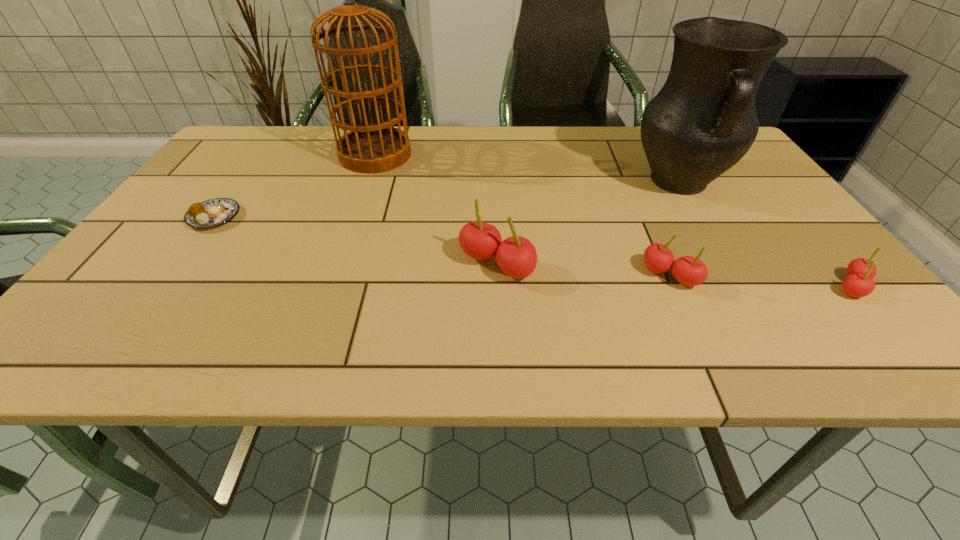
Where is `cherry at the right edge`? The height and width of the screenshot is (540, 960). cherry at the right edge is located at coordinates (859, 283).

Find the location of a particular element. The height and width of the screenshot is (540, 960). pitcher that is positioned at the right edge is located at coordinates (702, 122).

Find the location of a particular element. This screenshot has width=960, height=540. object positioned at the far right corner is located at coordinates (702, 122).

Locate an element on the screen. The image size is (960, 540). object positioned at the near right corner is located at coordinates click(x=859, y=283).

The height and width of the screenshot is (540, 960). What are the coordinates of `vacant space at the far edge` in the screenshot? It's located at (499, 164).

You are a GUI agent. You are given a task and a screenshot of the screen. Output one action in this format:
    pyautogui.click(x=<x>, y=<y>)
    Task: Click on the vacant region at the near edge of the desktop
    This screenshot has height=540, width=960.
    Given the screenshot: What is the action you would take?
    pyautogui.click(x=746, y=287)

Where is `free spot at the left edge of the desktop`? The width and height of the screenshot is (960, 540). free spot at the left edge of the desktop is located at coordinates (228, 178).

This screenshot has height=540, width=960. Identify the location of vacant region at the far left corner of the desktop. (237, 147).

Find the location of `free space between the leftmost cherry and the second cherry from left to right`. free space between the leftmost cherry and the second cherry from left to right is located at coordinates (583, 271).

The width and height of the screenshot is (960, 540). I want to click on free space between the second cherry from left to right and the leftmost object, so click(443, 246).